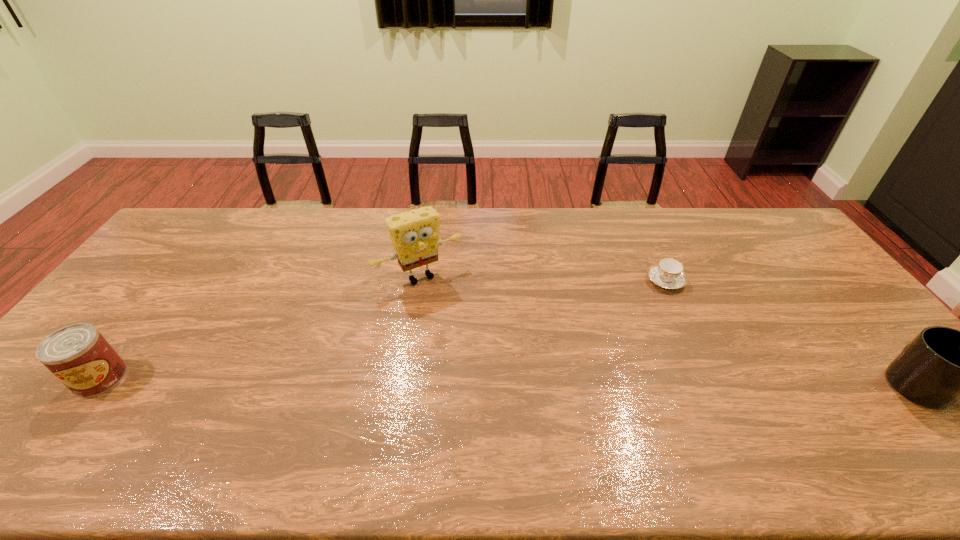
Locate an element on the screen. Image resolution: width=960 pixels, height=540 pixels. blank region between the leftmost object and the sponge is located at coordinates (260, 327).

The image size is (960, 540). Find the location of `unoccupied area between the can and the second object from right to left`. unoccupied area between the can and the second object from right to left is located at coordinates (383, 329).

This screenshot has height=540, width=960. I want to click on free space that is in between the sponge and the teacup, so click(x=542, y=279).

At what (x,y) coordinates should I click in order to perform the action: click on vacant region between the teacup and the sponge. Please return your answer as a coordinate pair (x, y). Looking at the image, I should click on (542, 279).

Locate an element on the screen. object that is the closest one to the shortest object is located at coordinates (941, 365).

The image size is (960, 540). Find the location of `object that stands as the closest to the teacup`. object that stands as the closest to the teacup is located at coordinates (941, 365).

Locate an element on the screen. This screenshot has width=960, height=540. vacant space that satisfies the following two spatial constraints: 1. on the back side of the second object from right to left; 2. on the left side of the can is located at coordinates (175, 281).

Find the location of a particular element. The width and height of the screenshot is (960, 540). free space that satisfies the following two spatial constraints: 1. on the back side of the can; 2. on the right side of the tallest object is located at coordinates (179, 276).